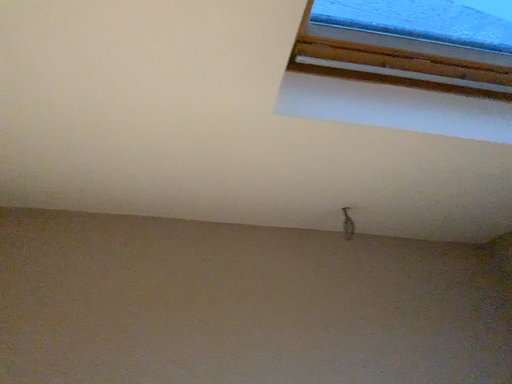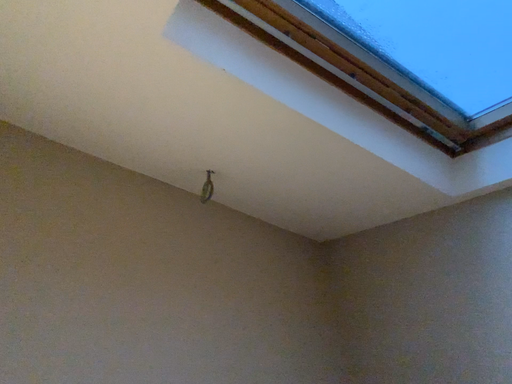
Question: Which way did the camera rotate in the video?

Choices:
 (A) rotated left
 (B) rotated right

Answer: (B)